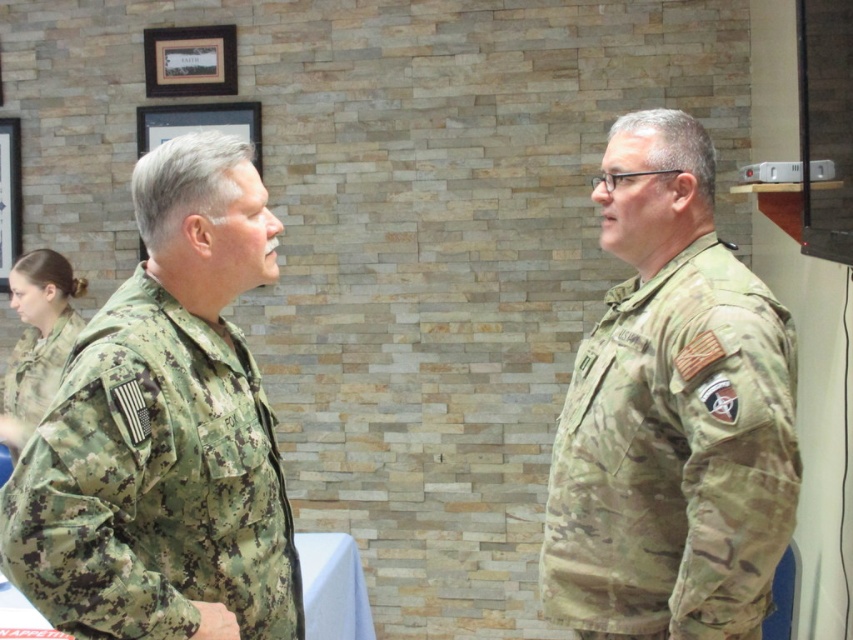
You are a photographer standing in front of the two military personnel. You need to take a photo of the camouflage fabric uniform at left represented by point (154, 483). Which individual should you focus on?

You should focus on the individual on the left because the camouflage fabric uniform at left represented by point (154, 483) is worn by him.

You are standing in the room where the two military personnel are talking. You need to deliver a message to the person wearing the camouflage uniform at right. Which direction should you walk to reach them from your current position at point 0,0?

The camouflage uniform at right is located at point (671,413), so you should walk northeast to reach them from your current position at point (0,0).